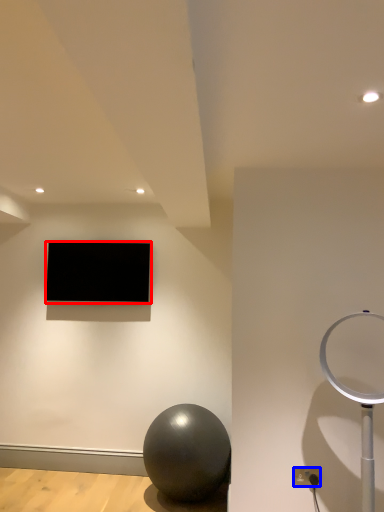
Question: Which object appears farthest to the camera in this image, television (highlighted by a red box) or electric outlet (highlighted by a blue box)?

Choices:
 (A) television
 (B) electric outlet

Answer: (A)